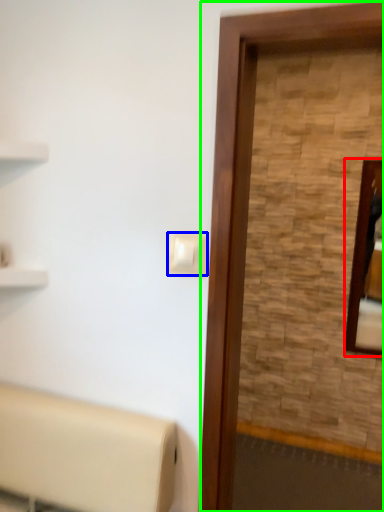
Question: Considering the real-world distances, which object is farthest from mirror (highlighted by a red box)? light switch (highlighted by a blue box) or screen door (highlighted by a green box)?

Choices:
 (A) light switch
 (B) screen door

Answer: (A)